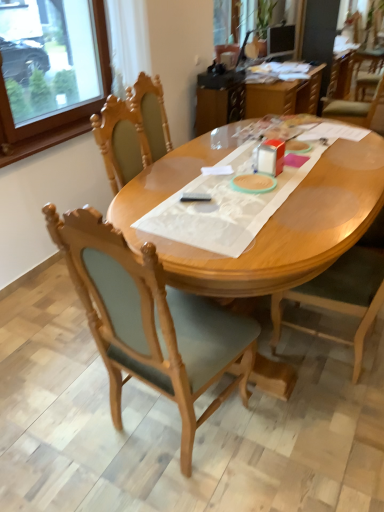
Question: From their relative heights in the image, would you say wooden chair at center, the 2th chair viewed from the left, is taller or shorter than translucent plastic table at upper center?

Choices:
 (A) short
 (B) tall

Answer: (B)

Question: From a real-world perspective, is wooden chair at center, the 2th chair viewed from the left, physically located above or below translucent plastic table at upper center?

Choices:
 (A) above
 (B) below

Answer: (A)

Question: Estimate the real-world distances between objects in this image. Which object is closer to the light brown wood desk at center?

Choices:
 (A) translucent plastic table at upper center
 (B) wooden chair at center, the 2th chair viewed from the left
 (C) wooden chair at center, which is counted as the 2th chair, starting from the right
 (D) wooden frame at upper left

Answer: (C)

Question: Which of these objects is positioned farthest from the translucent plastic table at upper center?

Choices:
 (A) wooden frame at upper left
 (B) wooden chair at center, which is counted as the 2th chair, starting from the right
 (C) light brown wood desk at center
 (D) wooden chair at center, the 2th chair viewed from the left

Answer: (B)